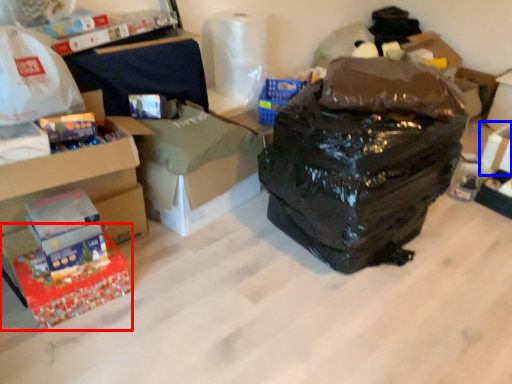
Question: Which object appears farthest to the camera in this image, box (highlighted by a red box) or storage box (highlighted by a blue box)?

Choices:
 (A) box
 (B) storage box

Answer: (B)